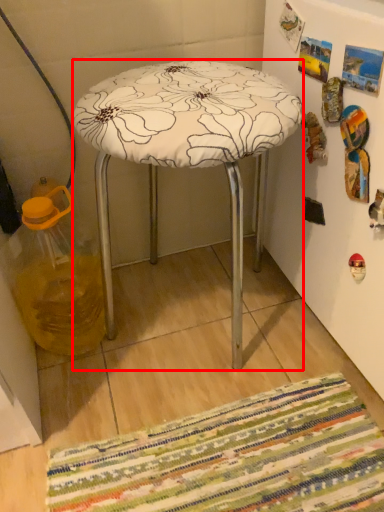
Question: From the image's perspective, what is the correct spatial positioning of stool (annotated by the red box) in reference to glass jar?

Choices:
 (A) above
 (B) below

Answer: (A)